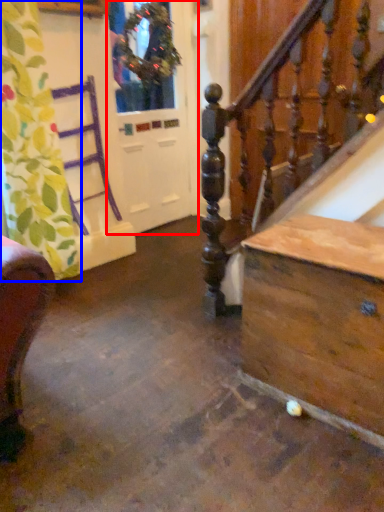
Question: Among these objects, which one is nearest to the camera, screen door (highlighted by a red box) or curtain (highlighted by a blue box)?

Choices:
 (A) screen door
 (B) curtain

Answer: (B)